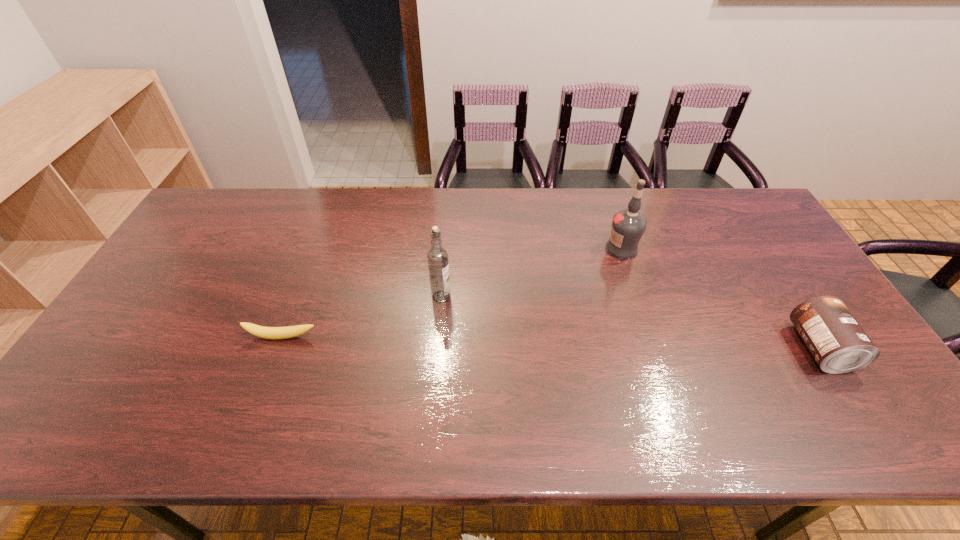
Where is `vacant space situated on the front label of the farther vodka`? The width and height of the screenshot is (960, 540). vacant space situated on the front label of the farther vodka is located at coordinates (548, 299).

This screenshot has height=540, width=960. In order to click on vacant space located 0.170m on the front label of the farther vodka in this screenshot , I will do `click(574, 281)`.

You are a GUI agent. You are given a task and a screenshot of the screen. Output one action in this format:
    pyautogui.click(x=<x>, y=<y>)
    Task: Click on the free space located on the label of the left vodka
    This screenshot has height=540, width=960.
    Given the screenshot: What is the action you would take?
    pyautogui.click(x=515, y=363)

This screenshot has height=540, width=960. In order to click on free space located 0.130m on the label of the left vodka in this screenshot , I will do `click(478, 330)`.

At what (x,y) coordinates should I click in order to perform the action: click on vacant space located 0.240m on the label of the left vodka. Please return your answer as a coordinate pair (x, y). Image resolution: width=960 pixels, height=540 pixels. Looking at the image, I should click on tap(507, 356).

Where is `object located in the near edge section of the desktop`? Image resolution: width=960 pixels, height=540 pixels. object located in the near edge section of the desktop is located at coordinates (838, 343).

You are a GUI agent. You are given a task and a screenshot of the screen. Output one action in this format:
    pyautogui.click(x=<x>, y=<y>)
    Task: Click on the object that is at the right edge
    This screenshot has width=960, height=540.
    Given the screenshot: What is the action you would take?
    pyautogui.click(x=838, y=343)

At what (x,y) coordinates should I click in order to perform the action: click on object at the near right corner. Please return your answer as a coordinate pair (x, y). The image size is (960, 540). Looking at the image, I should click on (838, 343).

Where is `vacant region at the far edge of the desktop`? This screenshot has height=540, width=960. vacant region at the far edge of the desktop is located at coordinates (540, 197).

Locate an element on the screen. vacant region at the near edge of the desktop is located at coordinates (680, 393).